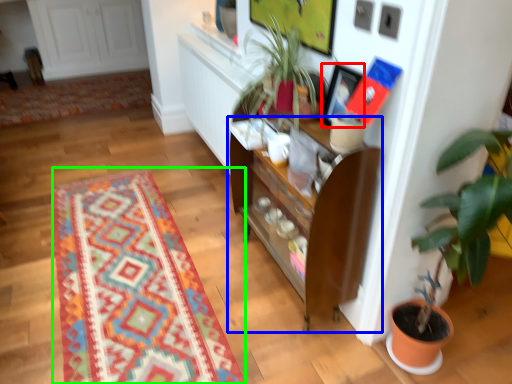
Question: Which object is the closest to the picture frame (highlighted by a red box)? Choose among these: cabinetry (highlighted by a blue box) or mat (highlighted by a green box).

Choices:
 (A) cabinetry
 (B) mat

Answer: (A)